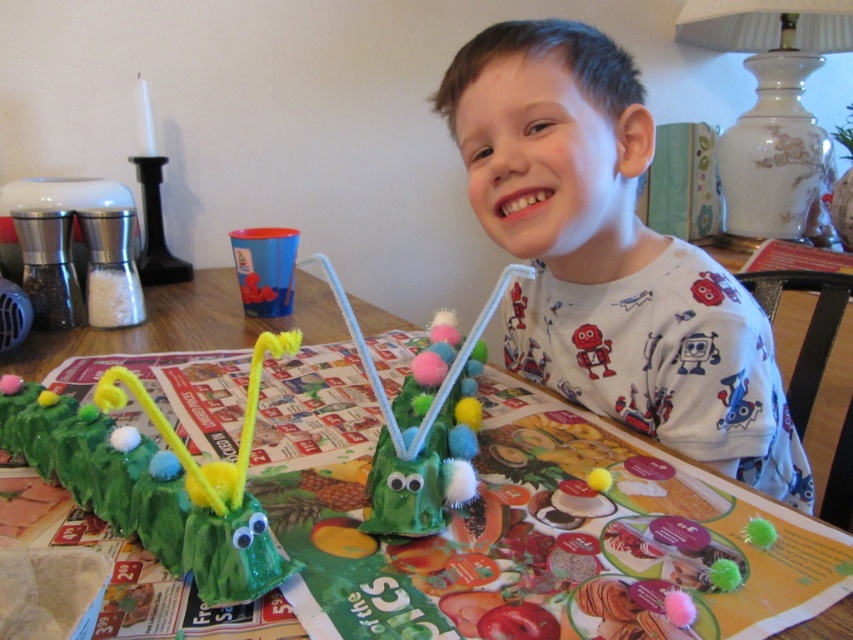
Who is higher up, white cotton shirt at upper center or green fuzzy caterpillar at center?

white cotton shirt at upper center

Can you confirm if white cotton shirt at upper center is wider than green fuzzy caterpillar at center?

Correct, the width of white cotton shirt at upper center exceeds that of green fuzzy caterpillar at center.

The height and width of the screenshot is (640, 853). What do you see at coordinates (611, 257) in the screenshot?
I see `white cotton shirt at upper center` at bounding box center [611, 257].

At what (x,y) coordinates should I click in order to perform the action: click on white cotton shirt at upper center. Please return your answer as a coordinate pair (x, y). Looking at the image, I should click on (611, 257).

Can you confirm if green paper table at center is positioned above green fuzzy caterpillar at center?

Indeed, green paper table at center is positioned over green fuzzy caterpillar at center.

Who is shorter, green paper table at center or green fuzzy caterpillar at center?

green fuzzy caterpillar at center is shorter.

Is point (146, 328) positioned before point (467, 483)?

No, (146, 328) is behind (467, 483).

Identify the location of green paper table at center. Image resolution: width=853 pixels, height=640 pixels. pyautogui.click(x=184, y=323).

Can you confirm if green felt caterpillar at lower left is shorter than green fuzzy caterpillar at center?

Yes.

Between green felt caterpillar at lower left and green fuzzy caterpillar at center, which one is positioned higher?

green fuzzy caterpillar at center

Locate an element on the screen. This screenshot has width=853, height=640. green felt caterpillar at lower left is located at coordinates (148, 483).